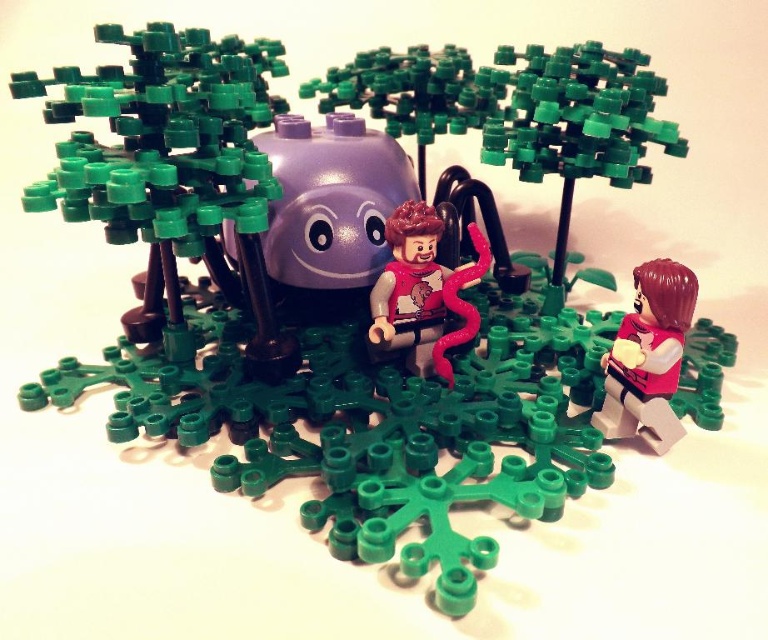
You are holding a camera and want to take a photo of the LEGO diorama. The camera is currently positioned at a point that is 86.85 centimeters away from the point marked at coordinates (611, 369). If you move the camera closer so that it is now 50 centimeters away from the point, will the LEGO structure at that point appear larger in the photo?

Yes, moving the camera closer to the point marked at coordinates (611, 369) from 86.85 centimeters to 50 centimeters will make the LEGO structure at that point appear larger in the photo because the distance between the camera and the point has decreased.

In the LEGO diorama, there are two minifigures wearing smooth red vest at lower right and smooth red vest at center. Which of these two minifigures is shorter?

The smooth red vest at lower right is not as tall as the smooth red vest at center, so the minifigure wearing the smooth red vest at lower right is shorter.

In the scene shown: You are a LEGO minifigure in the scene. You need to locate the smooth red vest at lower right. Where exactly is it positioned in the scene?

The smooth red vest at lower right is positioned at point (649, 356).